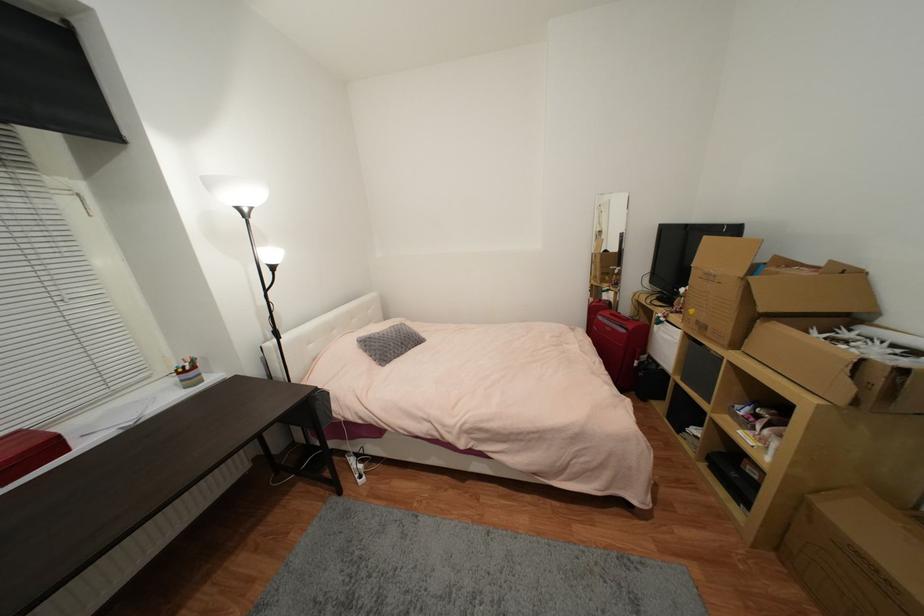
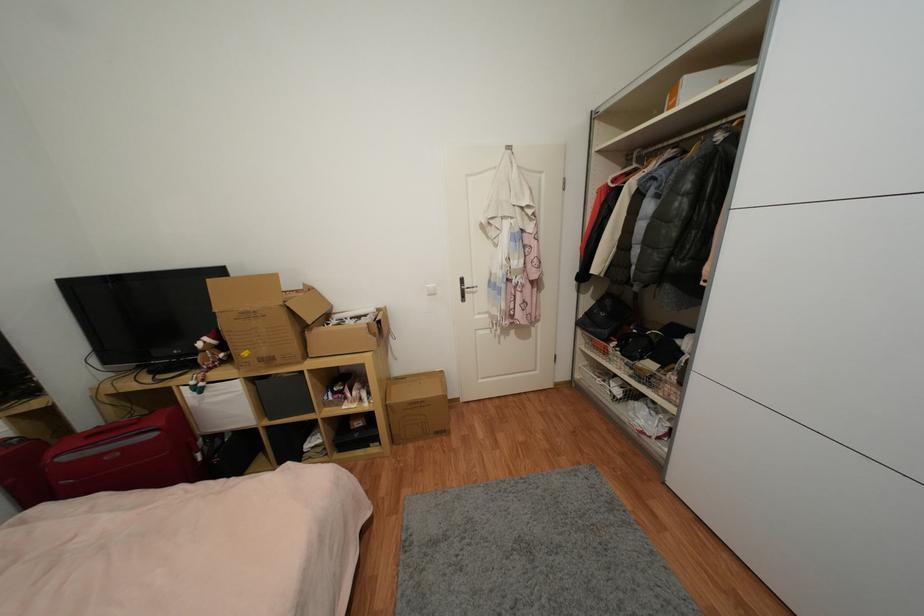
Find the pixel in the second image that matches point 708,329 in the first image.

(274, 361)